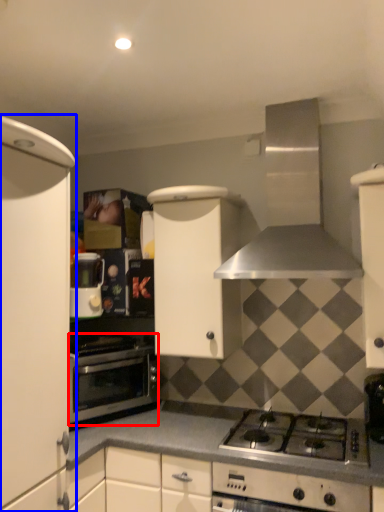
Question: Which object is closer to the camera taking this photo, oven (highlighted by a red box) or cabinetry (highlighted by a blue box)?

Choices:
 (A) oven
 (B) cabinetry

Answer: (B)